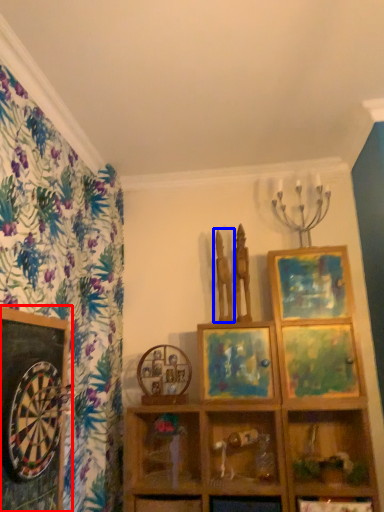
Question: Which object appears farthest to the camera in this image, picture frame (highlighted by a red box) or sculpture (highlighted by a blue box)?

Choices:
 (A) picture frame
 (B) sculpture

Answer: (B)